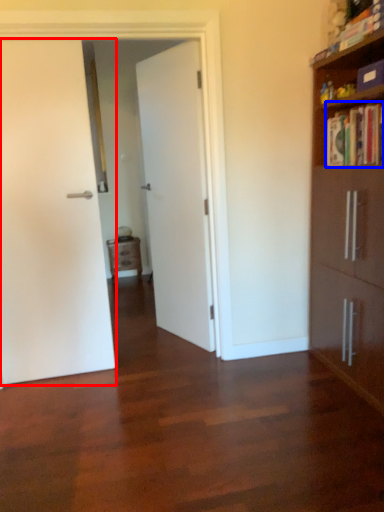
Question: Which object is further to the camera taking this photo, door (highlighted by a red box) or book (highlighted by a blue box)?

Choices:
 (A) door
 (B) book

Answer: (A)